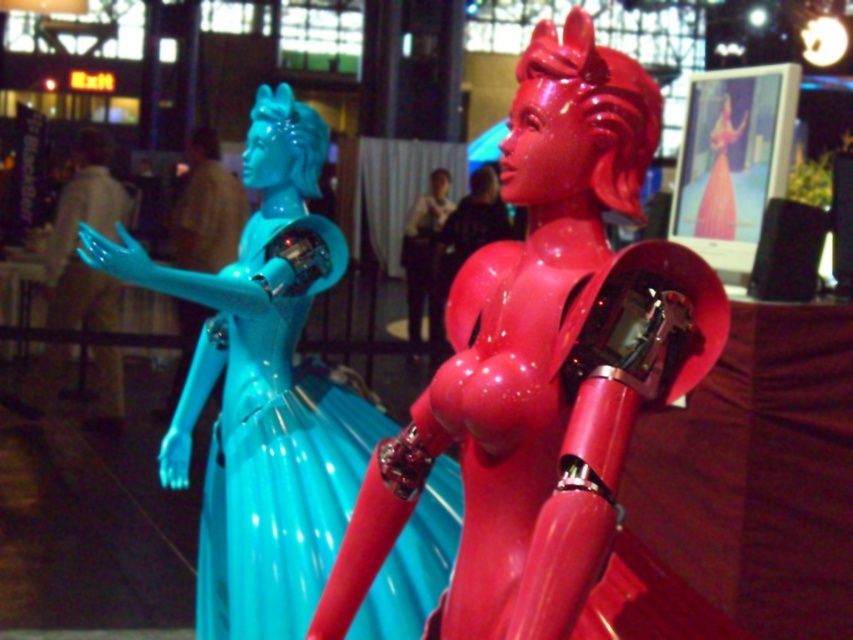
Is glossy plastic statue at left further to the viewer compared to glossy plastic woman at center?

That is False.

Who is more forward, (264, 164) or (428, 301)?

Positioned in front is point (264, 164).

This screenshot has width=853, height=640. I want to click on glossy plastic statue at left, so click(x=263, y=392).

Is glossy plastic doll at center in front of glossy plastic woman at center?

That is True.

Image resolution: width=853 pixels, height=640 pixels. Find the location of `glossy plastic doll at center`. glossy plastic doll at center is located at coordinates (550, 380).

Between glossy plastic doll at center and glossy plastic statue at left, which one has less height?

With less height is glossy plastic doll at center.

Between point (573, 253) and point (430, 560), which one is positioned in front?

Point (573, 253)

This screenshot has width=853, height=640. What are the coordinates of `glossy plastic doll at center` in the screenshot? It's located at (550, 380).